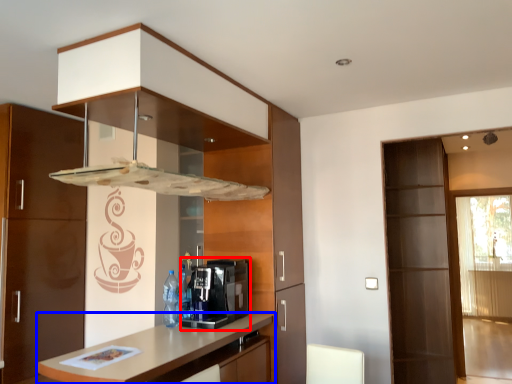
Question: Which point is further to the camera, coffee machine (highlighted by a red box) or countertop (highlighted by a blue box)?

Choices:
 (A) coffee machine
 (B) countertop

Answer: (A)